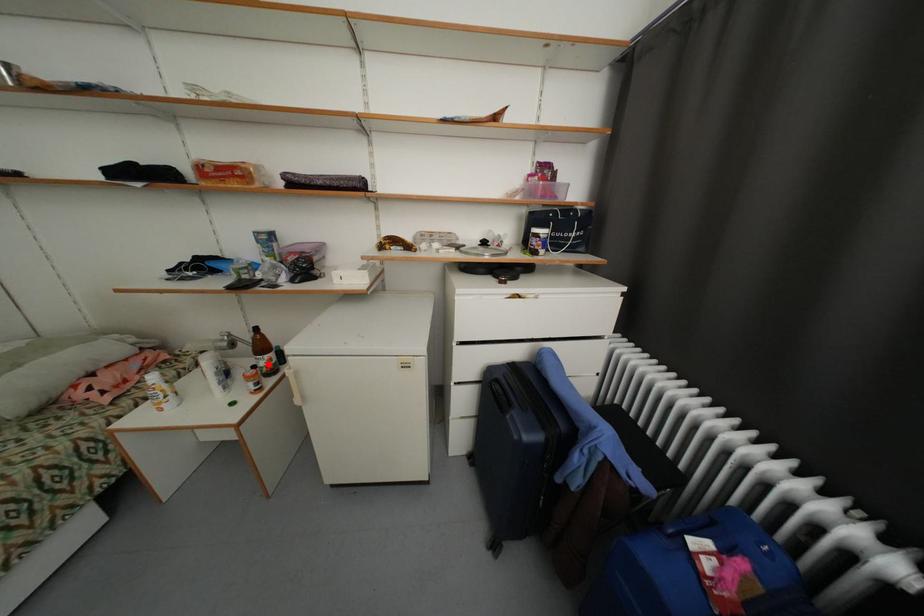
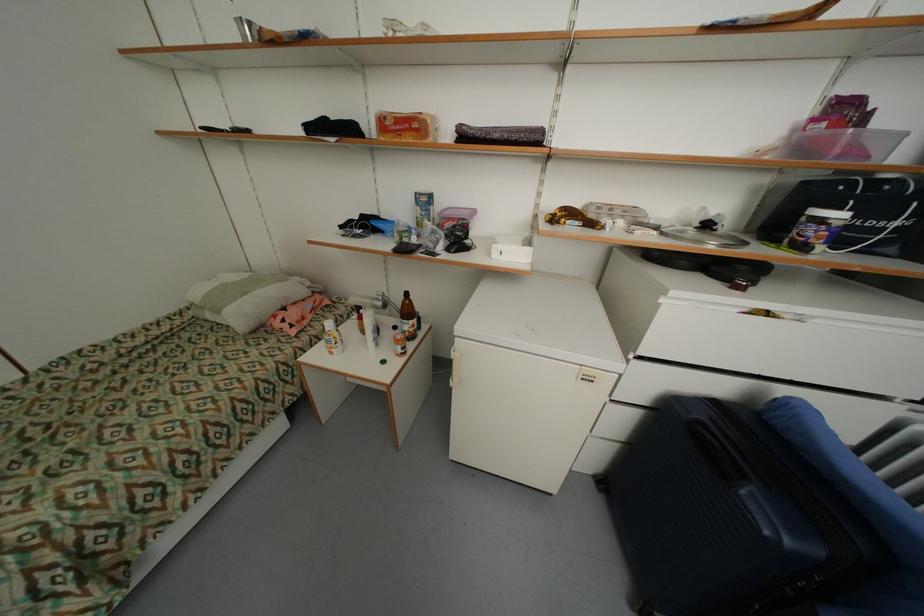
Find the pixel in the second image that matches the highlighted location in the first image.

(411, 329)